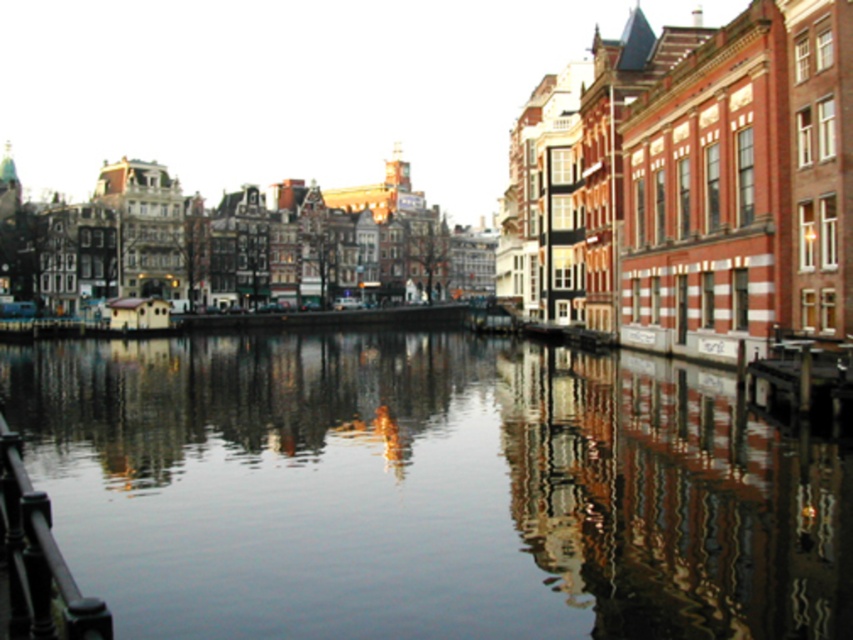
Between smooth reflective water at center and black metal railing at lower left, which one is positioned lower?

black metal railing at lower left

Where is `smooth reflective water at center`? smooth reflective water at center is located at coordinates (426, 490).